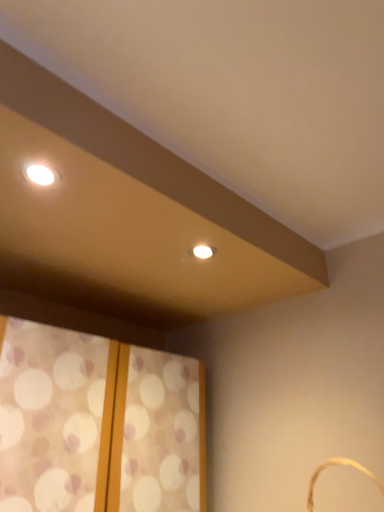
Describe the element at coordinates (337, 464) in the screenshot. This screenshot has width=384, height=512. I see `gold woven basket at lower right` at that location.

Locate an element on the screen. gold woven basket at lower right is located at coordinates (337, 464).

You are a GUI agent. You are given a task and a screenshot of the screen. Output one action in this format:
    pyautogui.click(x=<x>, y=<y>)
    Task: Click on the patterned fabric window at lower left
    The width and height of the screenshot is (384, 512).
    Given the screenshot: What is the action you would take?
    pyautogui.click(x=98, y=424)

In order to face patterned fabric window at lower left, should I rotate leftwards or rightwards?

Turn left approximately 12.869 degrees to face it.

Image resolution: width=384 pixels, height=512 pixels. What do you see at coordinates (98, 424) in the screenshot? I see `patterned fabric window at lower left` at bounding box center [98, 424].

Identify the location of gold woven basket at lower right. The height and width of the screenshot is (512, 384). (337, 464).

Does patterned fabric window at lower left appear on the right side of gold woven basket at lower right?

No, patterned fabric window at lower left is not to the right of gold woven basket at lower right.

Which is behind, patterned fabric window at lower left or gold woven basket at lower right?

patterned fabric window at lower left is further away from the camera.

Which point is more distant from viewer, (76, 509) or (317, 477)?

Point (317, 477)

From the image's perspective, does patterned fabric window at lower left appear lower than gold woven basket at lower right?

Indeed, from the image's perspective, patterned fabric window at lower left is shown beneath gold woven basket at lower right.

From a real-world perspective, does patterned fabric window at lower left sit lower than gold woven basket at lower right?

No.

Which object is wider, patterned fabric window at lower left or gold woven basket at lower right?

patterned fabric window at lower left.

Between patterned fabric window at lower left and gold woven basket at lower right, which one has less height?

Standing shorter between the two is gold woven basket at lower right.

Looking at the image, does patterned fabric window at lower left seem bigger or smaller compared to gold woven basket at lower right?

Clearly, patterned fabric window at lower left is larger in size than gold woven basket at lower right.

Is patterned fabric window at lower left surrounding gold woven basket at lower right?

Definitely not — gold woven basket at lower right is not inside patterned fabric window at lower left.

Looking at this image, would you consider patterned fabric window at lower left to be distant from gold woven basket at lower right?

No, patterned fabric window at lower left is not far away from gold woven basket at lower right.

Could you tell me if patterned fabric window at lower left is turned towards gold woven basket at lower right?

Yes, patterned fabric window at lower left is facing gold woven basket at lower right.

This screenshot has height=512, width=384. Identify the location of window positioned vertically above the gold woven basket at lower right (from a real-world perspective). (98, 424).

Is gold woven basket at lower right to the right of patterned fabric window at lower left from the viewer's perspective?

Correct, you'll find gold woven basket at lower right to the right of patterned fabric window at lower left.

Is gold woven basket at lower right closer to the viewer compared to patterned fabric window at lower left?

Yes.

Does point (327, 466) come in front of point (27, 480)?

No, it is not.

From the image's perspective, between gold woven basket at lower right and patterned fabric window at lower left, which one is located above?

gold woven basket at lower right is shown above in the image.

From a real-world perspective, is gold woven basket at lower right positioned above or below patterned fabric window at lower left?

Clearly, from a real-world perspective, gold woven basket at lower right is below patterned fabric window at lower left.

Between gold woven basket at lower right and patterned fabric window at lower left, which one has smaller width?

gold woven basket at lower right is thinner.

Considering the sizes of objects gold woven basket at lower right and patterned fabric window at lower left in the image provided, who is taller, gold woven basket at lower right or patterned fabric window at lower left?

With more height is patterned fabric window at lower left.

From the picture: In terms of size, does gold woven basket at lower right appear bigger or smaller than patterned fabric window at lower left?

Clearly, gold woven basket at lower right is smaller in size than patterned fabric window at lower left.

Could patterned fabric window at lower left be considered to be inside gold woven basket at lower right?

Actually, patterned fabric window at lower left is outside gold woven basket at lower right.

Is gold woven basket at lower right far from patterned fabric window at lower left?

They are positioned close to each other.

Is gold woven basket at lower right oriented away from patterned fabric window at lower left?

No, gold woven basket at lower right's orientation is not away from patterned fabric window at lower left.

How different are the orientations of gold woven basket at lower right and patterned fabric window at lower left in degrees?

There is a 92-degree angle between the facing directions of gold woven basket at lower right and patterned fabric window at lower left.

Where is `basket below the patterned fabric window at lower left (from a real-world perspective)`? Image resolution: width=384 pixels, height=512 pixels. basket below the patterned fabric window at lower left (from a real-world perspective) is located at coordinates tap(337, 464).

Image resolution: width=384 pixels, height=512 pixels. I want to click on basket on the right of patterned fabric window at lower left, so click(x=337, y=464).

Image resolution: width=384 pixels, height=512 pixels. Identify the location of basket below the patterned fabric window at lower left (from a real-world perspective). (337, 464).